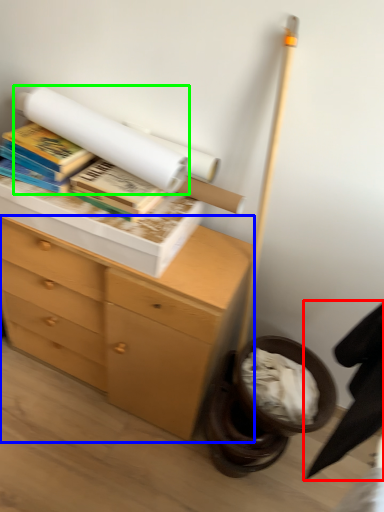
Question: Which is nearer to the swivel chair (highlighted by a red box)? chest of drawers (highlighted by a blue box) or book (highlighted by a green box).

Choices:
 (A) chest of drawers
 (B) book

Answer: (A)